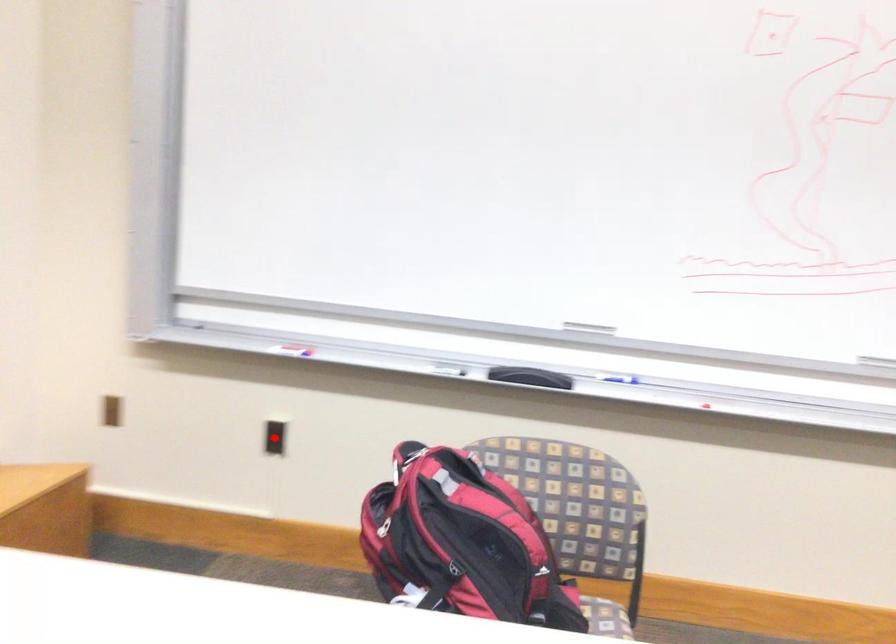
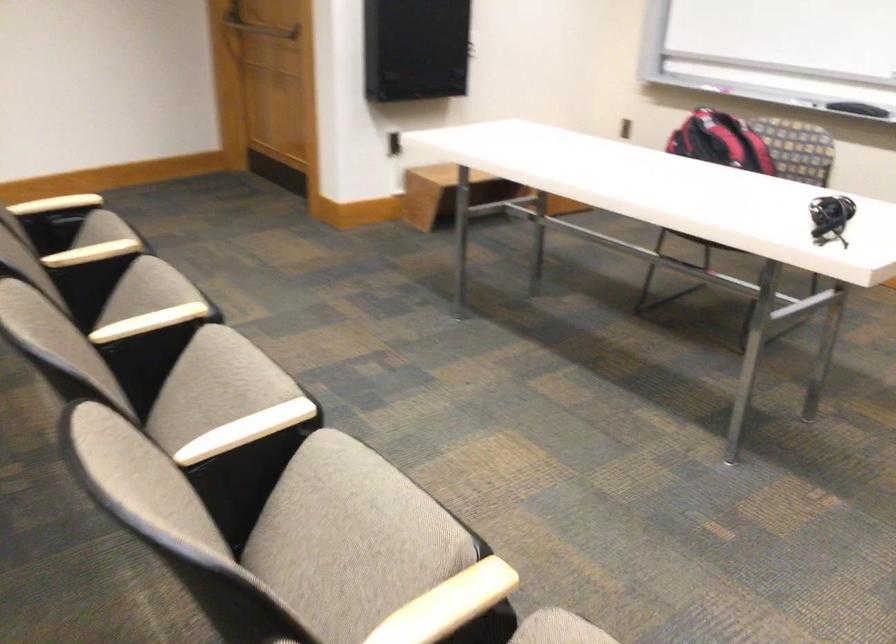
Question: I am providing you with two images of the same scene from different viewpoints. A red point is marked on the first image. Can you still see the location of the red point in image 2?

Choices:
 (A) Yes
 (B) No

Answer: (B)